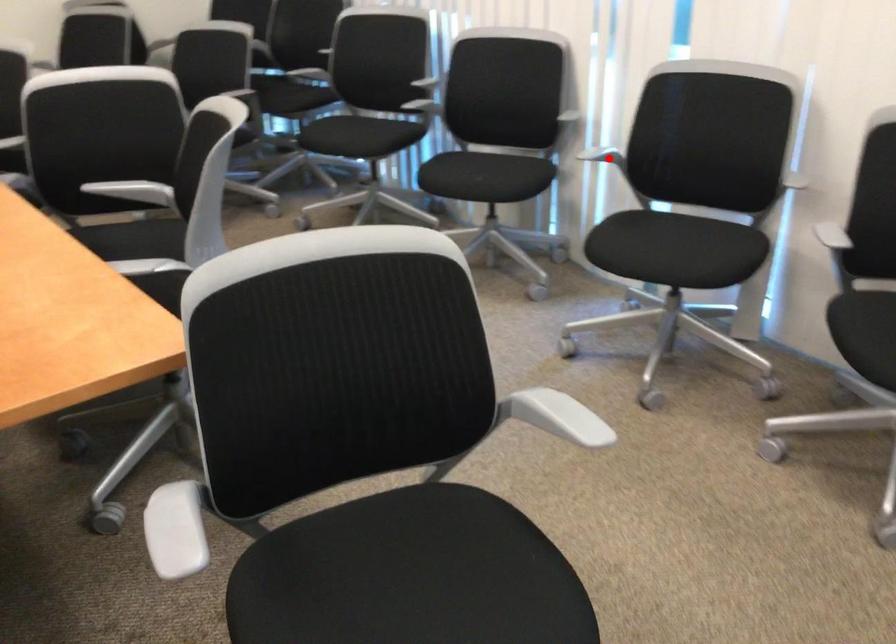
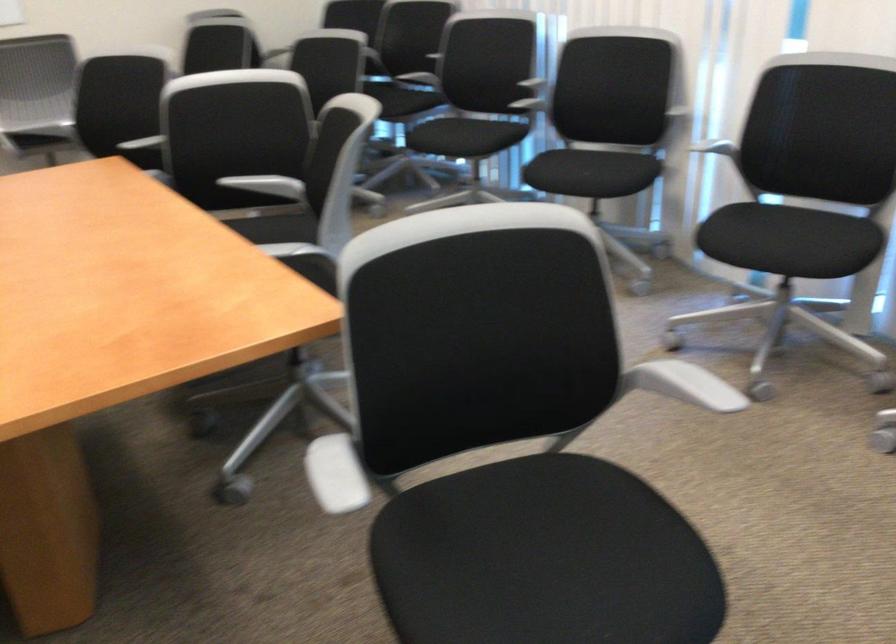
Question: I am providing you with two images of the same scene from different viewpoints. A red point is marked on the first image. Is the red point's position out of view in image 2?

Choices:
 (A) Yes
 (B) No

Answer: (B)